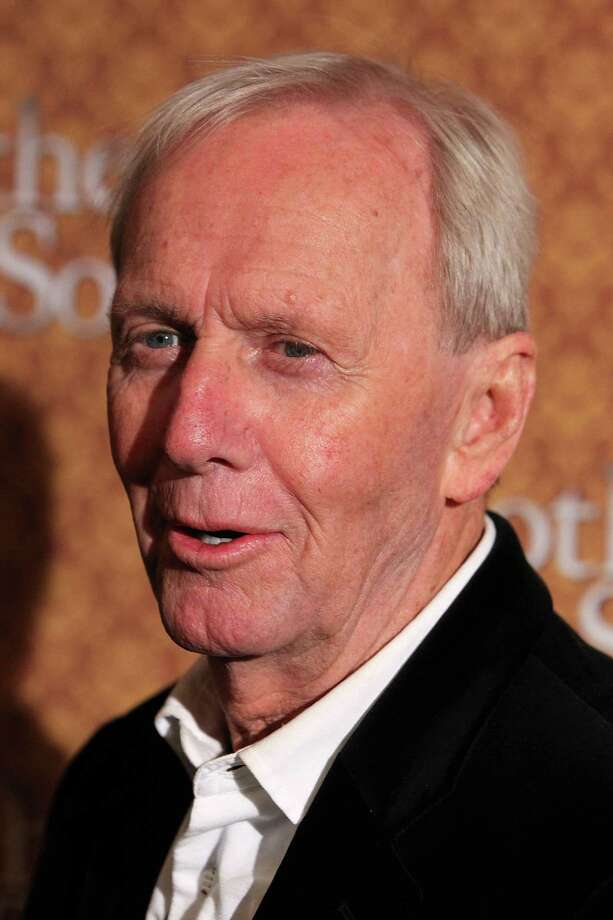
I want to click on wall, so click(x=101, y=569).